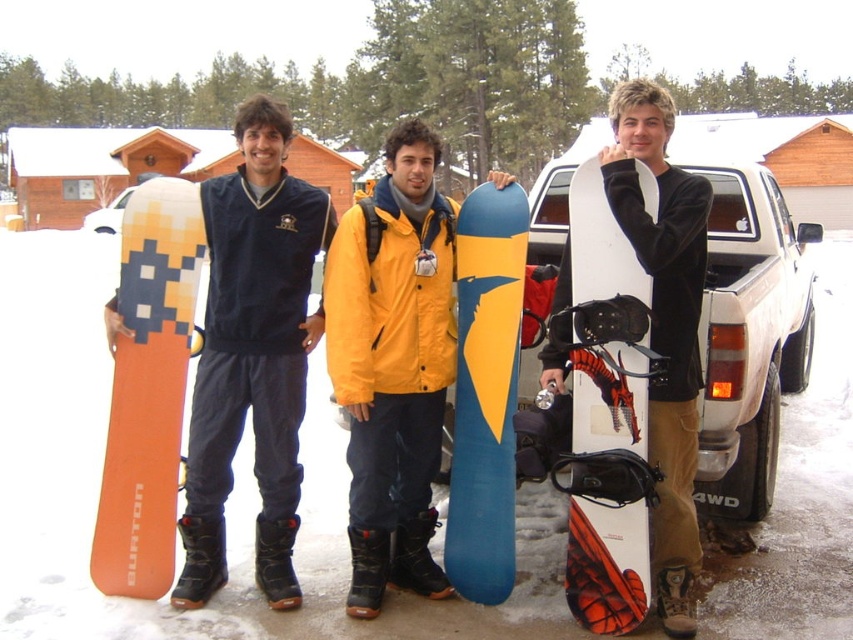
You are a photographer trying to capture a photo of the blue matte snowboard at center and the white matte snowboard at right. Based on their positions, which snowboard should you focus on first to ensure both are in frame without moving the camera?

The blue matte snowboard at center is below the white matte snowboard at right, so you should focus on the white matte snowboard at right first to ensure both are in frame without moving the camera.

You are standing in the snowy parking area and want to walk towards the two points marked in the image. Which point, point (x=434, y=509) or point (x=619, y=282), will you reach first?

You will reach point (x=434, y=509) first because it is closer to you than point (x=619, y=282).